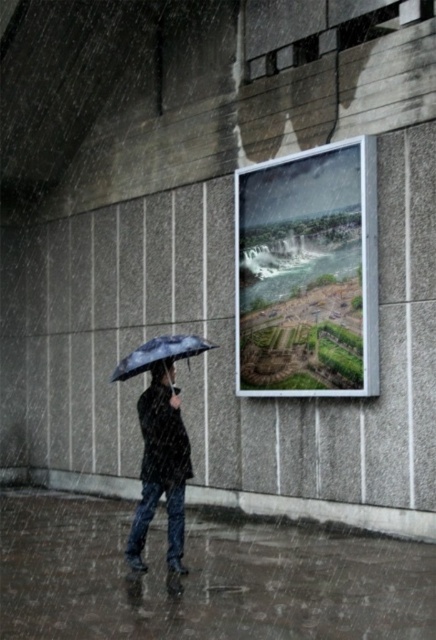
Between dark blue matte umbrella at center and matte black umbrella at center, which one is positioned higher?

matte black umbrella at center is above.

Is dark blue matte umbrella at center wider than matte black umbrella at center?

No.

Is point (170, 547) less distant than point (132, 353)?

Yes, it is in front of point (132, 353).

At what (x,y) coordinates should I click in order to perform the action: click on dark blue matte umbrella at center. Please return your answer as a coordinate pair (x, y). This screenshot has height=640, width=436. Looking at the image, I should click on (160, 467).